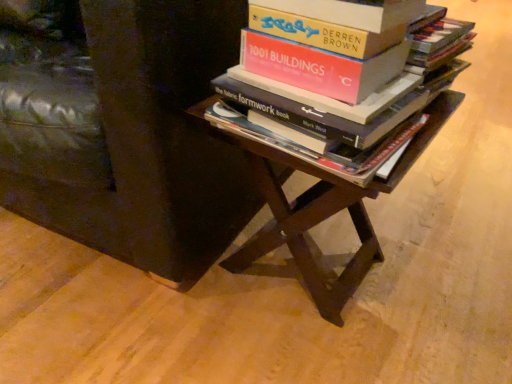
Question: Is wooden side table at center taller than brown wooden table at center?

Choices:
 (A) yes
 (B) no

Answer: (A)

Question: From a real-world perspective, is wooden side table at center located beneath brown wooden table at center?

Choices:
 (A) no
 (B) yes

Answer: (A)

Question: Would you say brown wooden table at center is part of wooden side table at center's contents?

Choices:
 (A) yes
 (B) no

Answer: (B)

Question: Can you see wooden side table at center touching brown wooden table at center?

Choices:
 (A) yes
 (B) no

Answer: (B)

Question: Is wooden side table at center located outside brown wooden table at center?

Choices:
 (A) no
 (B) yes

Answer: (B)

Question: Is point (168, 196) positioned closer to the camera than point (367, 129)?

Choices:
 (A) farther
 (B) closer

Answer: (A)

Question: From the image's perspective, is wooden side table at center above or below hardcover book at center?

Choices:
 (A) above
 (B) below

Answer: (A)

Question: Which is correct: wooden side table at center is inside hardcover book at center, or outside of it?

Choices:
 (A) outside
 (B) inside

Answer: (A)

Question: From a real-world perspective, is wooden side table at center physically located above or below hardcover book at center?

Choices:
 (A) above
 (B) below

Answer: (B)

Question: Considering the positions of point pyautogui.click(x=309, y=140) and point pyautogui.click(x=73, y=195), is point pyautogui.click(x=309, y=140) closer or farther from the camera than point pyautogui.click(x=73, y=195)?

Choices:
 (A) farther
 (B) closer

Answer: (B)

Question: Based on their sizes in the image, would you say hardcover book at center is bigger or smaller than wooden side table at center?

Choices:
 (A) small
 (B) big

Answer: (A)

Question: From the image's perspective, is hardcover book at center positioned above or below wooden side table at center?

Choices:
 (A) below
 (B) above

Answer: (A)

Question: Considering their positions, is hardcover book at center located in front of or behind wooden side table at center?

Choices:
 (A) front
 (B) behind

Answer: (A)

Question: Is hardcover book at center in front of or behind brown wooden table at center in the image?

Choices:
 (A) behind
 (B) front

Answer: (B)

Question: Considering the relative positions of hardcover book at center and brown wooden table at center in the image provided, is hardcover book at center to the left or to the right of brown wooden table at center?

Choices:
 (A) left
 (B) right

Answer: (A)